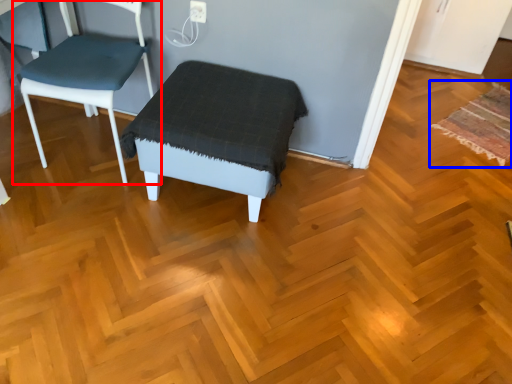
Question: Which object appears farthest to the camera in this image, chair (highlighted by a red box) or mat (highlighted by a blue box)?

Choices:
 (A) chair
 (B) mat

Answer: (B)